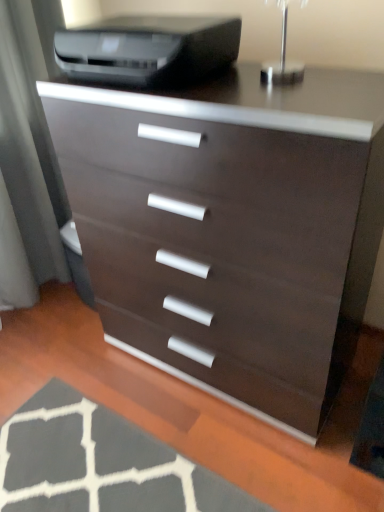
Question: From a real-world perspective, is matte gray screen door at left above or below matte brown chest of drawers at center?

Choices:
 (A) above
 (B) below

Answer: (A)

Question: Does point (21, 196) appear closer or farther from the camera than point (157, 167)?

Choices:
 (A) closer
 (B) farther

Answer: (B)

Question: Considering the real-world distances, which object is closest to the matte brown chest of drawers at center?

Choices:
 (A) dark gray textured rug at lower left
 (B) matte gray screen door at left
 (C) matte black printer at upper center

Answer: (C)

Question: Which object is the closest to the matte black printer at upper center?

Choices:
 (A) dark gray textured rug at lower left
 (B) matte brown chest of drawers at center
 (C) matte gray screen door at left

Answer: (B)